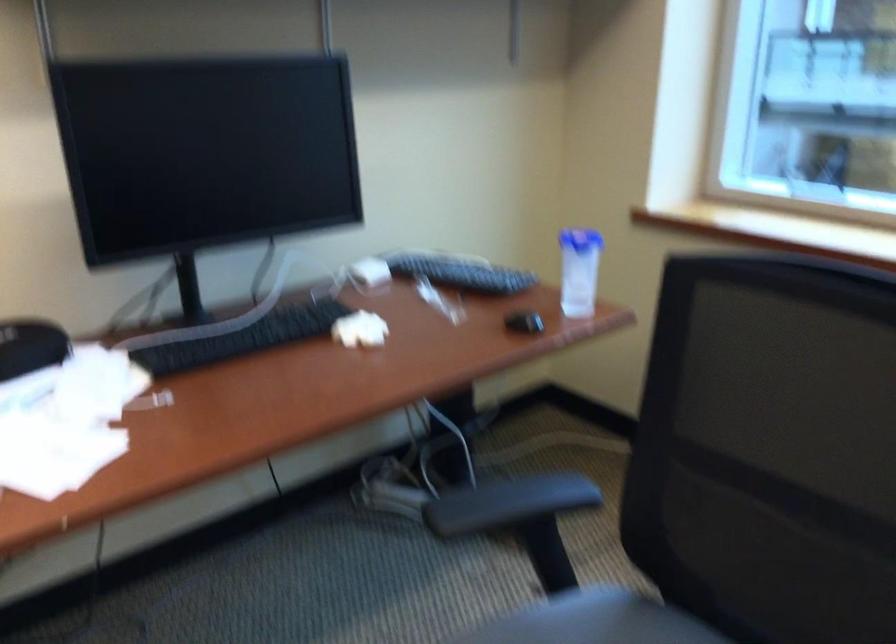
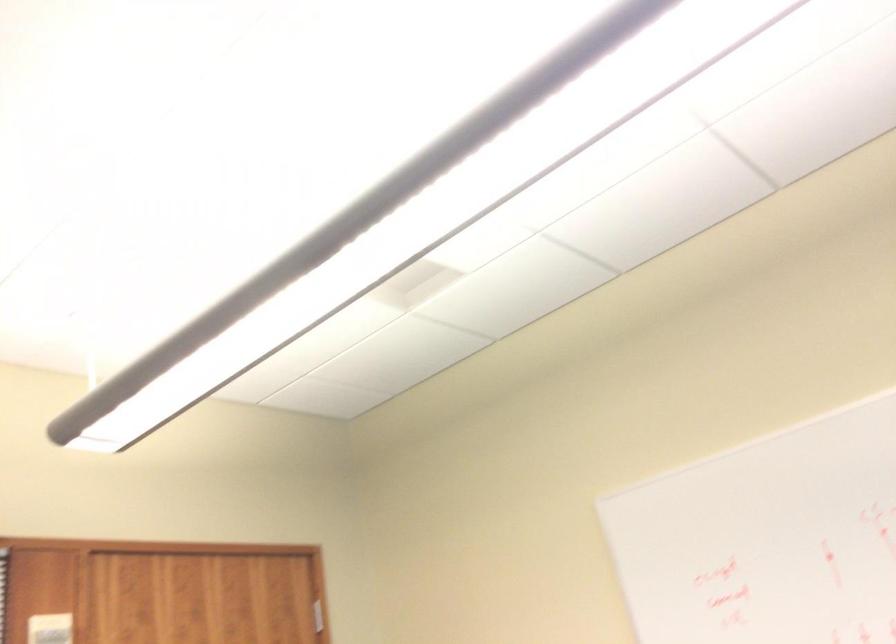
The images are taken continuously from a first-person perspective. In which direction is your viewpoint rotating?

The camera's rotation is toward left-up.